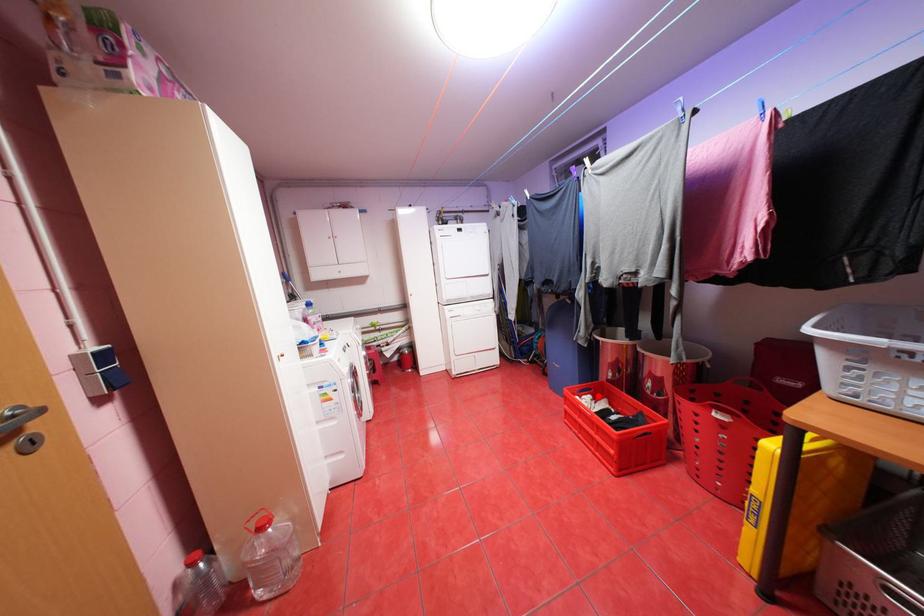
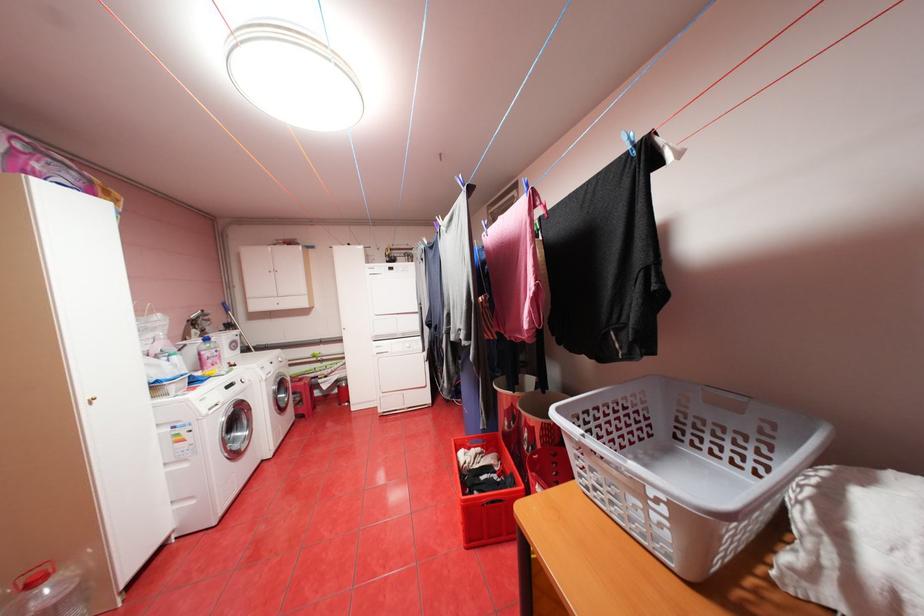
Find the pixel in the second image that matches the highlighted location in the first image.

(488, 448)